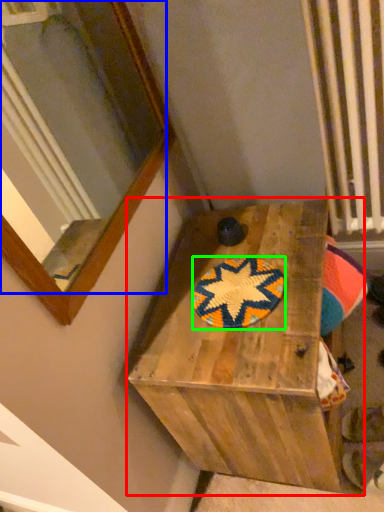
Question: Which object is positioned closest to furniture (highlighted by a red box)? Select from mirror (highlighted by a blue box) and mat (highlighted by a green box).

Choices:
 (A) mirror
 (B) mat

Answer: (B)